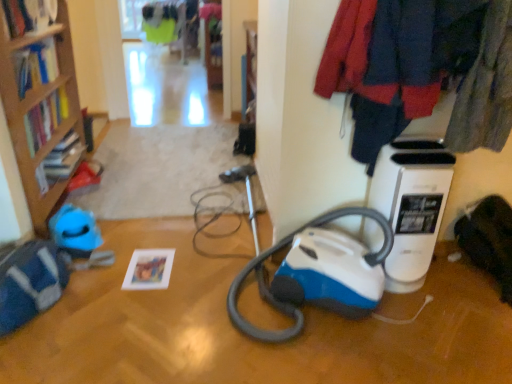
Question: Can we say hardcover book at left, placed as the second book when sorted from bottom to top, lies outside velvet-like fabric coat at upper right?

Choices:
 (A) no
 (B) yes

Answer: (B)

Question: Does hardcover book at left, the second book when ordered from top to bottom, have a greater height compared to velvet-like fabric coat at upper right?

Choices:
 (A) no
 (B) yes

Answer: (A)

Question: Can you confirm if hardcover book at left, which ranks as the second book in right-to-left order, is positioned to the right of velvet-like fabric coat at upper right?

Choices:
 (A) yes
 (B) no

Answer: (B)

Question: Is hardcover book at left, the second book when ordered from top to bottom, shorter than velvet-like fabric coat at upper right?

Choices:
 (A) no
 (B) yes

Answer: (B)

Question: Is velvet-like fabric coat at upper right inside hardcover book at left, placed as the second book when sorted from bottom to top?

Choices:
 (A) no
 (B) yes

Answer: (A)

Question: In terms of height, does hardcover book at left, placed as the second book when sorted from bottom to top, look taller or shorter compared to matte paper photo frame at lower left, placed as the 3th book when sorted from left to right?

Choices:
 (A) short
 (B) tall

Answer: (B)

Question: Choose the correct answer: Is hardcover book at left, arranged as the second book when viewed from the left, inside matte paper photo frame at lower left, which is counted as the first book, starting from the bottom, or outside it?

Choices:
 (A) outside
 (B) inside

Answer: (A)

Question: Is hardcover book at left, placed as the second book when sorted from bottom to top, to the left or to the right of matte paper photo frame at lower left, placed as the 3th book when sorted from left to right, in the image?

Choices:
 (A) right
 (B) left

Answer: (B)

Question: Is hardcover book at left, placed as the second book when sorted from bottom to top, bigger or smaller than matte paper photo frame at lower left, placed as the first book when sorted from right to left?

Choices:
 (A) small
 (B) big

Answer: (B)

Question: Looking at the image, does wooden bookcase at left seem bigger or smaller compared to matte paper photo frame at lower left, placed as the 3th book when sorted from left to right?

Choices:
 (A) big
 (B) small

Answer: (A)

Question: Is wooden bookcase at left in front of or behind matte paper photo frame at lower left, which is counted as the first book, starting from the bottom, in the image?

Choices:
 (A) behind
 (B) front

Answer: (B)

Question: Considering the positions of point (28, 135) and point (132, 288), is point (28, 135) closer or farther from the camera than point (132, 288)?

Choices:
 (A) farther
 (B) closer

Answer: (A)

Question: In terms of height, does wooden bookcase at left look taller or shorter compared to matte paper photo frame at lower left, placed as the 3th book when sorted from left to right?

Choices:
 (A) tall
 (B) short

Answer: (A)

Question: Choose the correct answer: Is hardcover book at upper left, which is the third book in right-to-left order, inside white plastic air purifier at right or outside it?

Choices:
 (A) outside
 (B) inside

Answer: (A)

Question: From the image's perspective, is hardcover book at upper left, which is counted as the third book, starting from the bottom, above or below white plastic air purifier at right?

Choices:
 (A) above
 (B) below

Answer: (A)